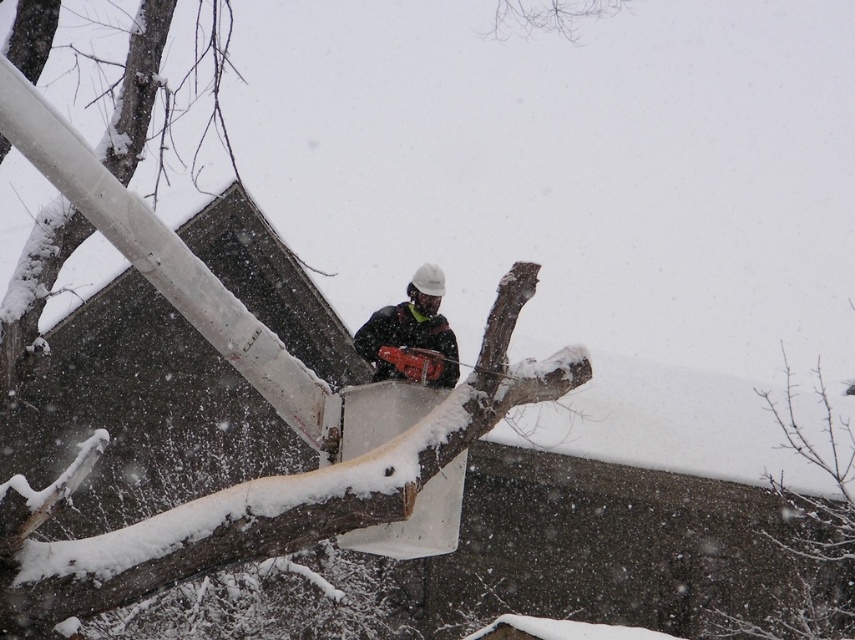
Question: Which point appears farthest from the camera in this image?

Choices:
 (A) (116, 548)
 (B) (835, 608)

Answer: (B)

Question: Which point is farther to the camera?

Choices:
 (A) matte black chainsaw at center
 (B) snow-covered branch at lower right

Answer: (B)

Question: In this image, where is brown rough wood at center located relative to snow-covered branch at lower right?

Choices:
 (A) right
 (B) left

Answer: (B)

Question: Is brown rough wood at center thinner than snow-covered branch at lower right?

Choices:
 (A) yes
 (B) no

Answer: (A)

Question: Is brown rough wood at center bigger than snow-covered branch at lower right?

Choices:
 (A) yes
 (B) no

Answer: (B)

Question: Which object appears closest to the camera in this image?

Choices:
 (A) matte black chainsaw at center
 (B) brown rough wood at center

Answer: (B)